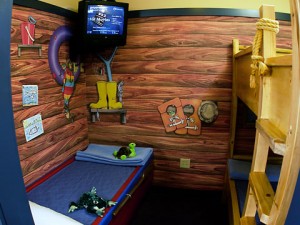
I want to click on 2 rectangles on the left wall, so 34,133, 27,94.